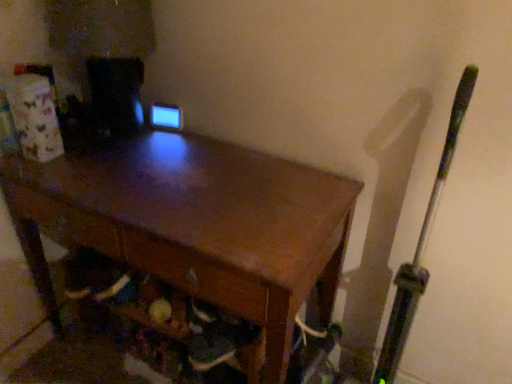
Measure the distance between wooden drawer at lower center and camera.

wooden drawer at lower center and camera are 33.62 inches apart from each other.

This screenshot has width=512, height=384. Identify the location of green metallic bat at right. (421, 245).

Can you confirm if wooden drawer at lower center is wider than green metallic bat at right?

Yes, wooden drawer at lower center is wider than green metallic bat at right.

From the image's perspective, is wooden drawer at lower center positioned above or below green metallic bat at right?

wooden drawer at lower center is situated higher than green metallic bat at right in the image.

Is green metallic bat at right at the back of wooden drawer at lower center?

That's not correct — wooden drawer at lower center is not looking away from green metallic bat at right.

How different are the orientations of green metallic bat at right and wooden desk at center in degrees?

The angular difference between green metallic bat at right and wooden desk at center is 0.000858 degrees.

Considering the relative positions of green metallic bat at right and wooden desk at center in the image provided, is green metallic bat at right to the left of wooden desk at center from the viewer's perspective?

In fact, green metallic bat at right is to the right of wooden desk at center.

From a real-world perspective, who is located higher, green metallic bat at right or wooden desk at center?

green metallic bat at right.

Does wooden desk at center appear on the right side of wooden drawer at lower center?

Correct, you'll find wooden desk at center to the right of wooden drawer at lower center.

Is wooden desk at center positioned in front of wooden drawer at lower center?

Yes, it is in front of wooden drawer at lower center.

Which of these two, wooden desk at center or wooden drawer at lower center, is bigger?

wooden desk at center is bigger.

From the image's perspective, relative to wooden drawer at lower center, is wooden desk at center above or below?

wooden desk at center is below wooden drawer at lower center.

Is wooden drawer at lower center not within wooden desk at center?

Actually, wooden drawer at lower center is within wooden desk at center.

From the picture: Which object is thinner, wooden drawer at lower center or wooden desk at center?

Thinner between the two is wooden drawer at lower center.

Measure the distance between wooden drawer at lower center and wooden desk at center.

A distance of 6.38 inches exists between wooden drawer at lower center and wooden desk at center.

From the image's perspective, is wooden drawer at lower center above wooden desk at center?

Yes, from the image's perspective, wooden drawer at lower center is on top of wooden desk at center.

Could you tell me if green metallic bat at right is turned towards wooden drawer at lower center?

No, green metallic bat at right is not aimed at wooden drawer at lower center.

From the image's perspective, is green metallic bat at right above wooden drawer at lower center?

No.

Is green metallic bat at right inside or outside of wooden drawer at lower center?

green metallic bat at right is spatially situated outside wooden drawer at lower center.

Is green metallic bat at right taller or shorter than wooden drawer at lower center?

Considering their sizes, green metallic bat at right has more height than wooden drawer at lower center.

Is wooden desk at center not inside green metallic bat at right?

Yes, wooden desk at center is located beyond the bounds of green metallic bat at right.

Does wooden desk at center have a greater width compared to green metallic bat at right?

Correct, the width of wooden desk at center exceeds that of green metallic bat at right.

Is point (321, 174) closer or farther from the camera than point (469, 68)?

Point (321, 174).

Is wooden desk at center to the left or to the right of green metallic bat at right in the image?

From the image, it's evident that wooden desk at center is to the left of green metallic bat at right.

Identify the location of baseball bat in front of the wooden drawer at lower center. This screenshot has height=384, width=512. (421, 245).

The width and height of the screenshot is (512, 384). Identify the location of desk that is under the green metallic bat at right (from a real-world perspective). (194, 224).

Which object lies nearer to the anchor point green metallic bat at right, wooden drawer at lower center or wooden desk at center?

Based on the image, wooden drawer at lower center appears to be nearer to green metallic bat at right.

Considering their positions, is green metallic bat at right positioned closer to wooden desk at center than wooden drawer at lower center?

Based on the image, wooden drawer at lower center appears to be nearer to wooden desk at center.

Considering their positions, is wooden drawer at lower center positioned further to wooden desk at center than green metallic bat at right?

The object further to wooden desk at center is green metallic bat at right.

Looking at the image, which one is located further to wooden drawer at lower center, green metallic bat at right or wooden desk at center?

Among the two, green metallic bat at right is located further to wooden drawer at lower center.

In the scene shown: Considering their positions, is wooden desk at center positioned further to green metallic bat at right than wooden drawer at lower center?

wooden desk at center lies further to green metallic bat at right than the other object.

Looking at the image, which one is located further to wooden drawer at lower center, wooden desk at center or green metallic bat at right?

green metallic bat at right is further to wooden drawer at lower center.

Image resolution: width=512 pixels, height=384 pixels. Identify the location of desk situated between wooden drawer at lower center and green metallic bat at right from left to right. (194, 224).